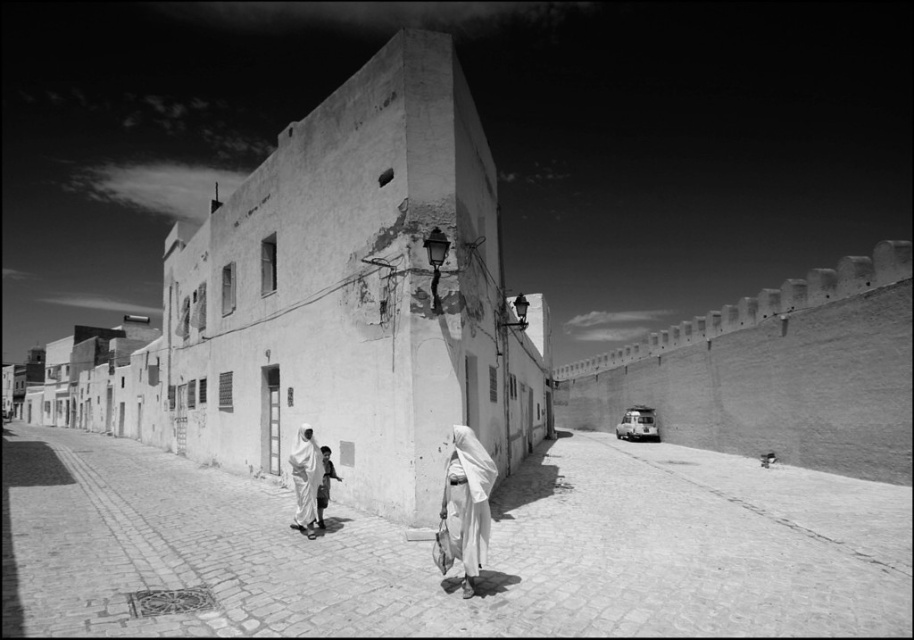
You are a tourist standing on the smooth stone alley at center and want to look up to see the white fabric headscarf at lower center. Is the headscarf above or below your head?

The smooth stone alley at center is positioned under the white fabric headscarf at lower center, so the headscarf is above your head.

You are standing at the entrance of a historic street and want to find the smooth stone alley at center. According to the coordinates given, where should you look to find it?

The smooth stone alley at center is located at the 2D coordinates point (430, 547).